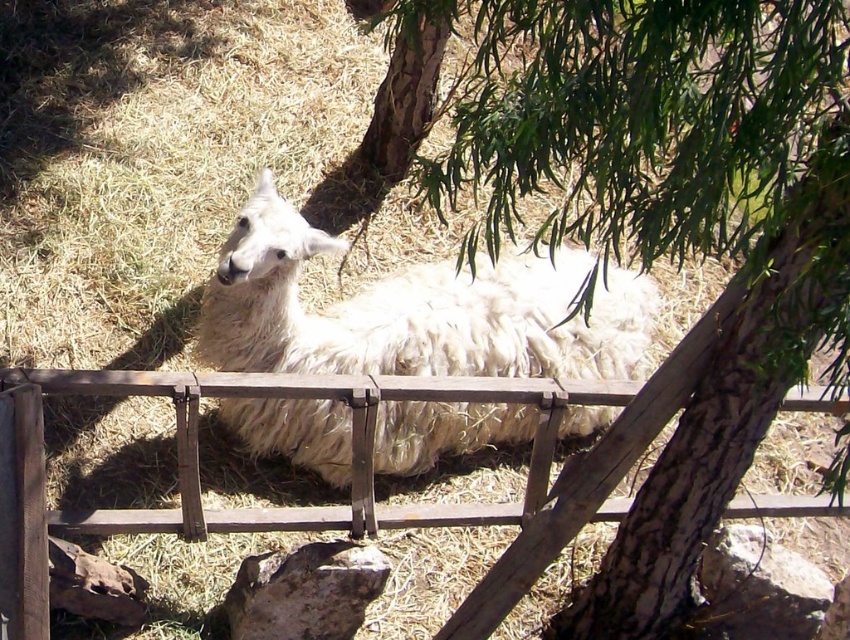
The image size is (850, 640). What do you see at coordinates (667, 221) in the screenshot?
I see `green leafy tree at center` at bounding box center [667, 221].

Is point (473, 120) farther from camera compared to point (554, 488)?

No, (473, 120) is in front of (554, 488).

What do you see at coordinates (667, 221) in the screenshot?
I see `green leafy tree at center` at bounding box center [667, 221].

You are a GUI agent. You are given a task and a screenshot of the screen. Output one action in this format:
    pyautogui.click(x=<x>, y=<y>)
    Task: Click on the green leafy tree at center
    The image size is (850, 640).
    Given the screenshot: What is the action you would take?
    pyautogui.click(x=667, y=221)

Is green leafy tree at center taller than white fluffy alpaca at center?

Yes, green leafy tree at center is taller than white fluffy alpaca at center.

What do you see at coordinates (667, 221) in the screenshot?
I see `green leafy tree at center` at bounding box center [667, 221].

The image size is (850, 640). What are the coordinates of `green leafy tree at center` in the screenshot? It's located at pos(667,221).

The height and width of the screenshot is (640, 850). I want to click on white fluffy alpaca at center, so click(x=414, y=310).

How far apart are white fluffy alpaca at center and wooden gate at center?

A distance of 27.97 inches exists between white fluffy alpaca at center and wooden gate at center.

This screenshot has width=850, height=640. What are the coordinates of `white fluffy alpaca at center` in the screenshot? It's located at (414, 310).